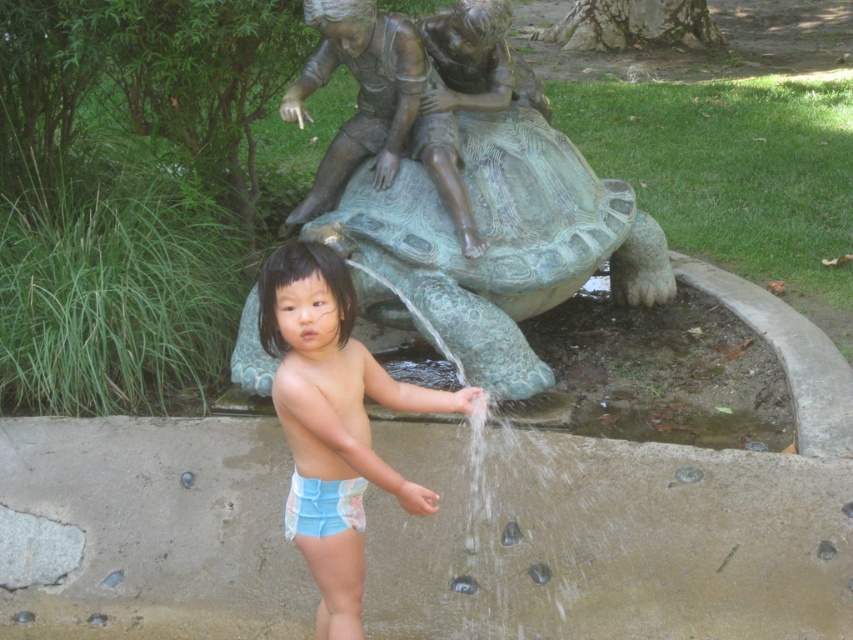
Question: Can you confirm if bronze statue at center is thinner than blue fabric shorts at center?

Choices:
 (A) no
 (B) yes

Answer: (A)

Question: Is bronze statue at center below blue fabric shorts at center?

Choices:
 (A) no
 (B) yes

Answer: (A)

Question: Can you confirm if bronze statue at center is wider than bronze textured turtle at center?

Choices:
 (A) no
 (B) yes

Answer: (B)

Question: Which point appears farthest from the camera in this image?

Choices:
 (A) (315, 529)
 (B) (344, 428)

Answer: (A)

Question: Which of the following is the farthest from the observer?

Choices:
 (A) (403, 118)
 (B) (306, 532)

Answer: (A)

Question: Which point is closer to the camera?

Choices:
 (A) (293, 512)
 (B) (363, 444)

Answer: (B)